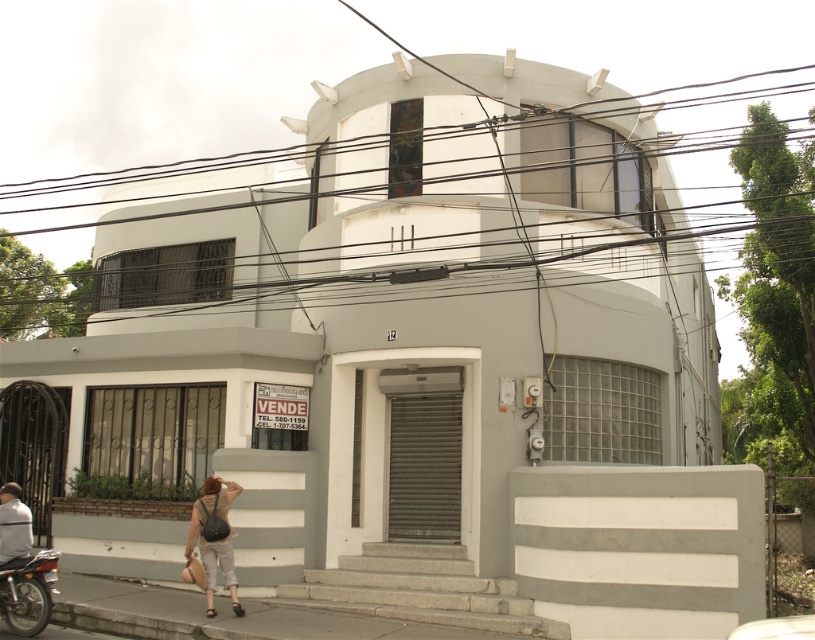
Question: Which point appears closest to the camera in this image?

Choices:
 (A) click(227, 513)
 (B) click(33, 602)
 (C) click(170, 164)

Answer: (B)

Question: Can you confirm if light beige pants at lower left is smaller than gray fabric jacket at lower left?

Choices:
 (A) no
 (B) yes

Answer: (A)

Question: Considering the real-world distances, which object is farthest from the metallic red motorcycle at lower left?

Choices:
 (A) gray fabric jacket at lower left
 (B) black wire at upper center

Answer: (B)

Question: Which point is closer to the camera?

Choices:
 (A) (18, 493)
 (B) (231, 596)
 (C) (49, 586)
 (D) (754, 92)

Answer: (C)

Question: Can you confirm if light beige pants at lower left is thinner than metallic red motorcycle at lower left?

Choices:
 (A) yes
 (B) no

Answer: (A)

Question: Is black wire at upper center below metallic red motorcycle at lower left?

Choices:
 (A) no
 (B) yes

Answer: (A)